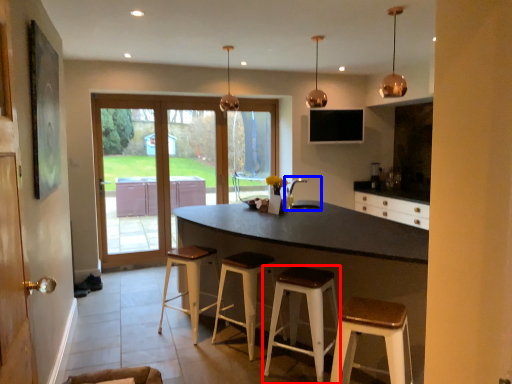
Question: Which object appears farthest to the camera in this image, stool (highlighted by a red box) or sink (highlighted by a blue box)?

Choices:
 (A) stool
 (B) sink

Answer: (B)